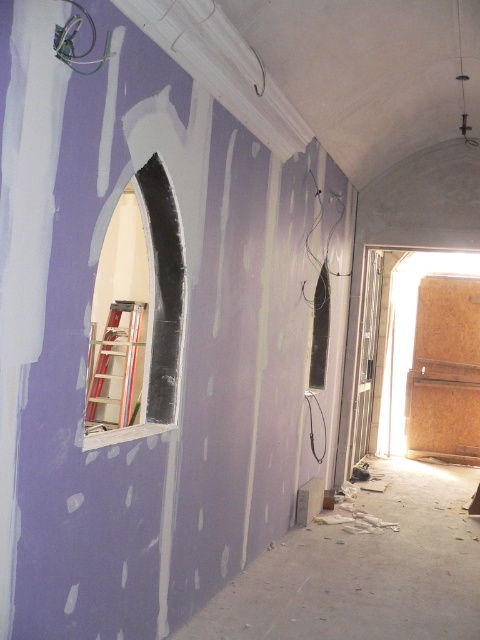
Based on the photo, you are a contractor assessing the space. You need to place a large equipment that requires more space than the smooth white archway at center. Can the metallic silver ladder at left be moved to accommodate this equipment?

The smooth white archway at center is smaller than the metallic silver ladder at left, so the ladder may require more space. Moving the metallic silver ladder at left could free up enough space to accommodate the large equipment.

You are standing in the room and want to locate the smooth white archway at center. According to the coordinates provided, where should you look?

The smooth white archway at center is located at the coordinates point (164, 291).

You are a construction worker standing at the entrance of the room with an arched opening. You need to reach a point marked at coordinate point (x=156, y=316) to install a light fixture. Considering your arm length is 2.5 feet, can you reach that point from your current position without moving closer?

The distance between point (x=156, y=316) and the viewer is 10.57 feet, which is much greater than your arm length of 2.5 feet. Therefore, you cannot reach the point from your current position without moving closer.